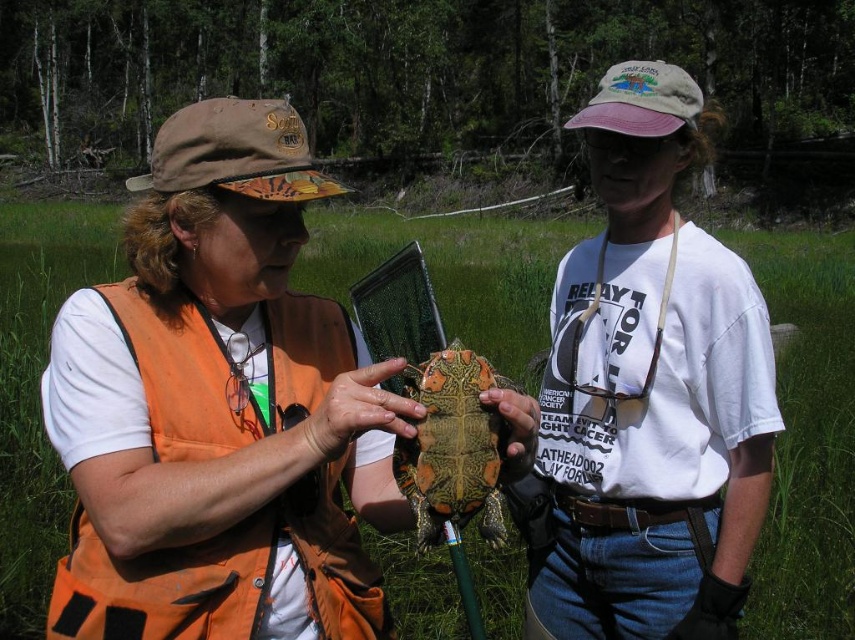
Question: Is matte orange vest at left bigger than white cotton shirt at center?

Choices:
 (A) no
 (B) yes

Answer: (B)

Question: Considering the real-world distances, which object is closest to the white cotton shirt at center?

Choices:
 (A) matte orange vest at left
 (B) camouflage-patterned turtle at center

Answer: (B)

Question: Which is farther from the matte orange vest at left?

Choices:
 (A) camouflage-patterned turtle at center
 (B) white cotton shirt at center

Answer: (B)

Question: Is matte orange vest at left to the right of white cotton shirt at center from the viewer's perspective?

Choices:
 (A) no
 (B) yes

Answer: (A)

Question: Among these objects, which one is nearest to the camera?

Choices:
 (A) camouflage-patterned turtle at center
 (B) white cotton shirt at center

Answer: (A)

Question: In this image, where is white cotton shirt at center located relative to camouflage-patterned turtle at center?

Choices:
 (A) below
 (B) above

Answer: (B)